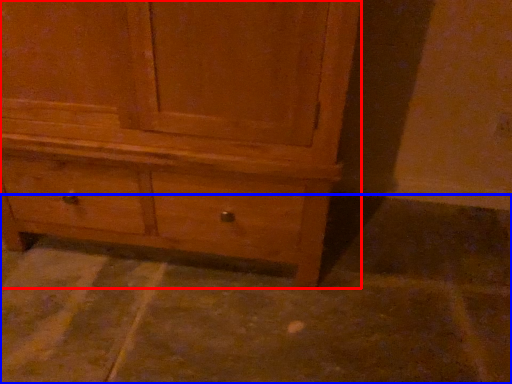
Question: Which object is closer to the camera taking this photo, chest of drawers (highlighted by a red box) or concrete (highlighted by a blue box)?

Choices:
 (A) chest of drawers
 (B) concrete

Answer: (A)